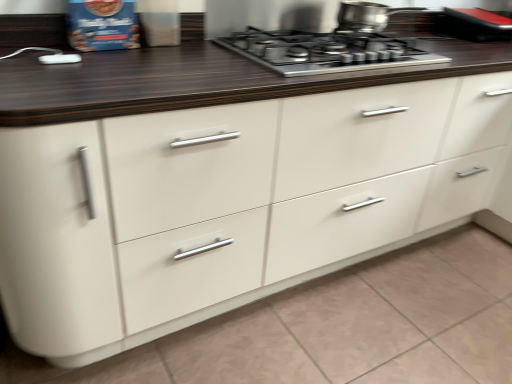
Question: Is point (344, 14) positioned closer to the camera than point (458, 14)?

Choices:
 (A) closer
 (B) farther

Answer: (A)

Question: In the image, is stainless steel pot at upper center on the left side or the right side of black rubberized phone at upper right?

Choices:
 (A) right
 (B) left

Answer: (B)

Question: Which is farther from the stainless steel gas stove at upper center?

Choices:
 (A) black rubberized phone at upper right
 (B) stainless steel pot at upper center

Answer: (A)

Question: Estimate the real-world distances between objects in this image. Which object is farther from the stainless steel pot at upper center?

Choices:
 (A) black rubberized phone at upper right
 (B) stainless steel gas stove at upper center

Answer: (A)